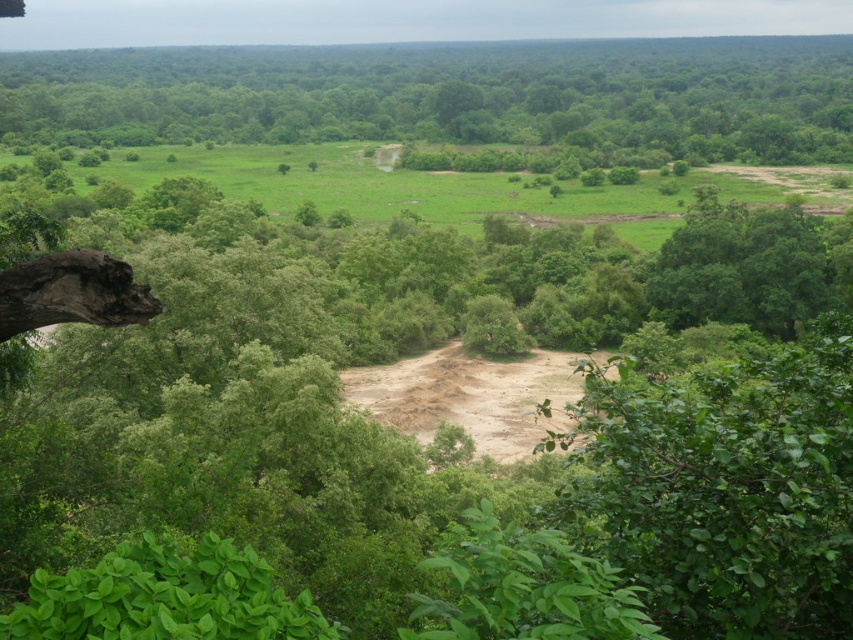
You are a hiker who wants to cross the brown sandy dirt track at center without getting your shoes dirty. There is a green leafy tree at upper left nearby. Can you use the tree to avoid stepping on the track?

The green leafy tree at upper left is positioned over the brown sandy dirt track at center. You can walk under the tree to stay on the leaves and avoid the sandy track below.

You are a hiker trying to navigate through the dense forest. You see a green leafy tree at upper left and a brown sandy dirt track at center. Which path should you follow to find the widest route?

The green leafy tree at upper left has a larger width than the brown sandy dirt track at center, so following the path near the green leafy tree at upper left would provide a wider route.

You are a hiker who wants to take a photo of the brown sandy dirt track at center from the green leafy tree at upper left. Which direction should you face to capture the track in your view?

The green leafy tree at upper left is to the left of the brown sandy dirt track at center, so you should face to the right to capture the track in your view.